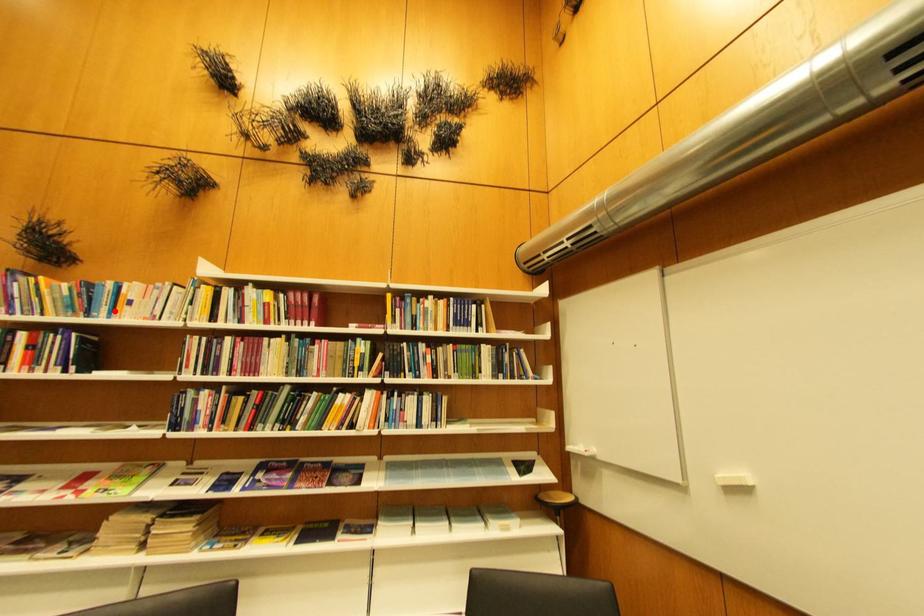
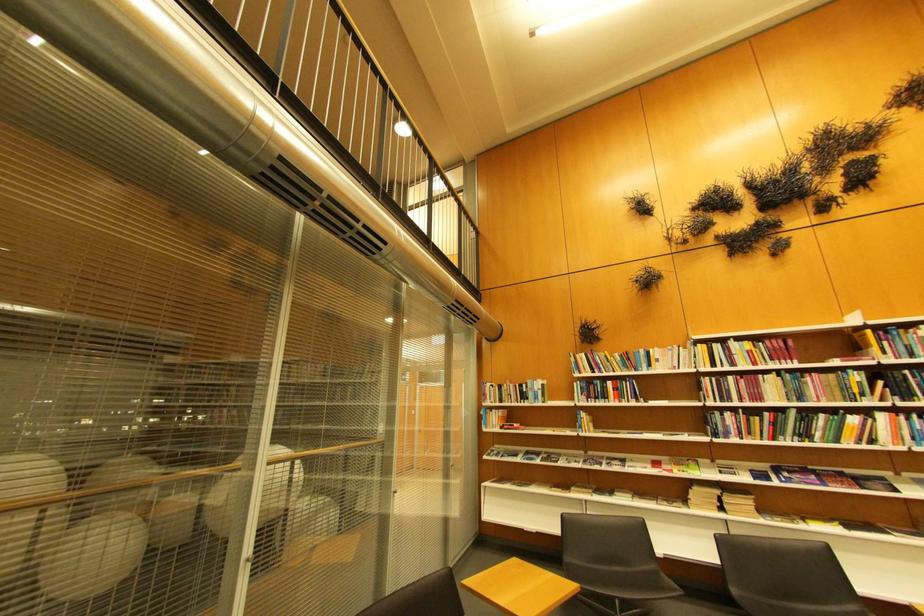
Locate, in the second image, the point that corresponds to the highlighted location in the first image.

(654, 368)